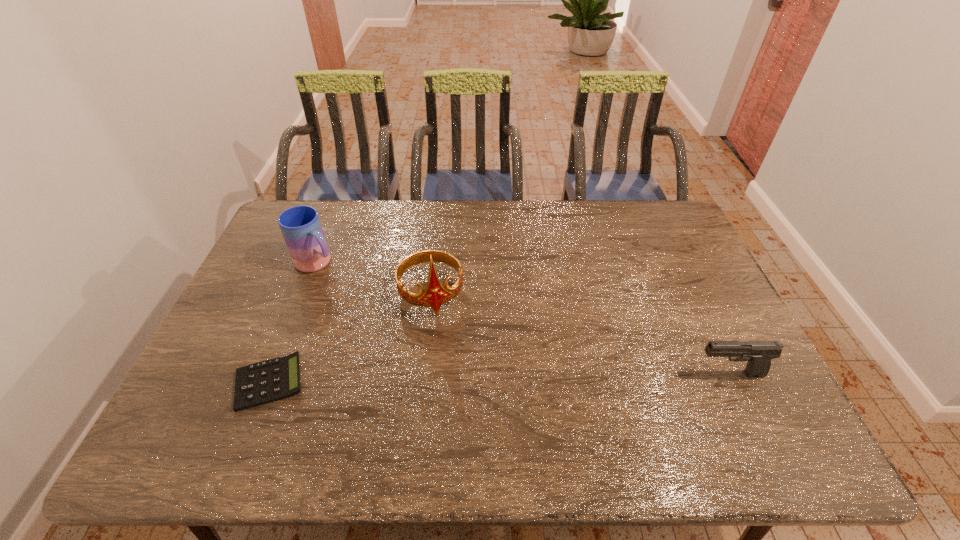
This screenshot has width=960, height=540. Identify the location of vacant space on the desktop that is between the shortest object and the second shortest object and is positioned on the front-facing side of the tallest object. (452, 379).

Where is `free space on the desktop that is between the shortest object and the rightmost object and is positioned on the side of the third shortest object with the handle`? free space on the desktop that is between the shortest object and the rightmost object and is positioned on the side of the third shortest object with the handle is located at coordinates (470, 379).